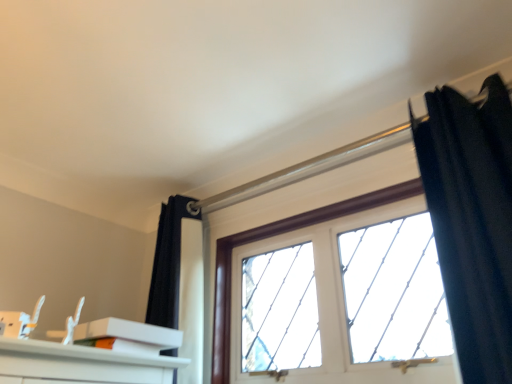
Question: Is clear glass window at center inside or outside of black velvet curtain at upper right?

Choices:
 (A) inside
 (B) outside

Answer: (B)

Question: From the image's perspective, is clear glass window at center positioned above or below black velvet curtain at upper right?

Choices:
 (A) below
 (B) above

Answer: (A)

Question: Based on their relative distances, which object is farther from the white matte box at lower left?

Choices:
 (A) clear glass window at center
 (B) black velvet curtain at upper right

Answer: (B)

Question: Which of these objects is positioned closest to the white matte box at lower left?

Choices:
 (A) clear glass window at center
 (B) black velvet curtain at upper right

Answer: (A)